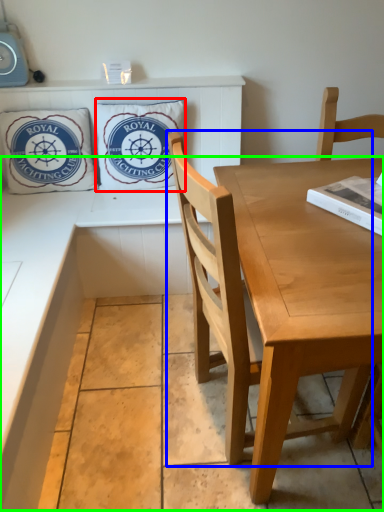
Question: Which is farther away from pillow (highlighted by a red box)? chair (highlighted by a blue box) or counter (highlighted by a green box)?

Choices:
 (A) chair
 (B) counter

Answer: (A)